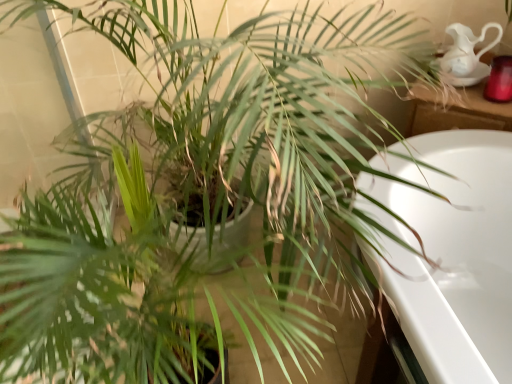
This screenshot has width=512, height=384. What do you see at coordinates (465, 49) in the screenshot?
I see `white glossy pitcher at upper right` at bounding box center [465, 49].

Locate an element on the screen. The height and width of the screenshot is (384, 512). white glossy pitcher at upper right is located at coordinates (465, 49).

Where is `white glossy pitcher at upper right`? The image size is (512, 384). white glossy pitcher at upper right is located at coordinates pyautogui.click(x=465, y=49).